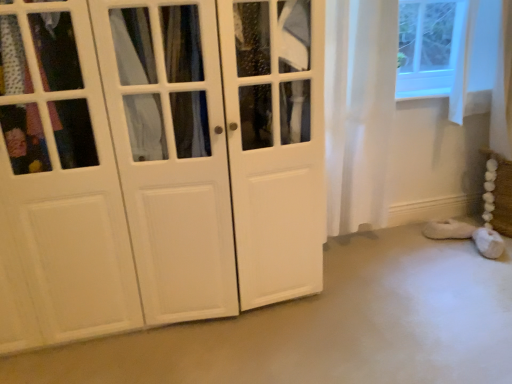
Identify the location of vacant region to the left of white fluffy slipper at lower right. The image size is (512, 384). (412, 244).